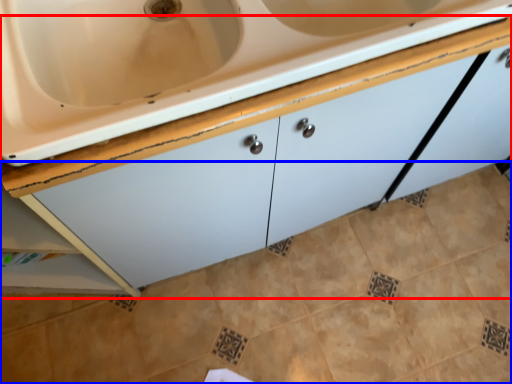
Question: Among these objects, which one is farthest to the camera, cabinetry (highlighted by a red box) or ceramic tile (highlighted by a blue box)?

Choices:
 (A) cabinetry
 (B) ceramic tile

Answer: (B)